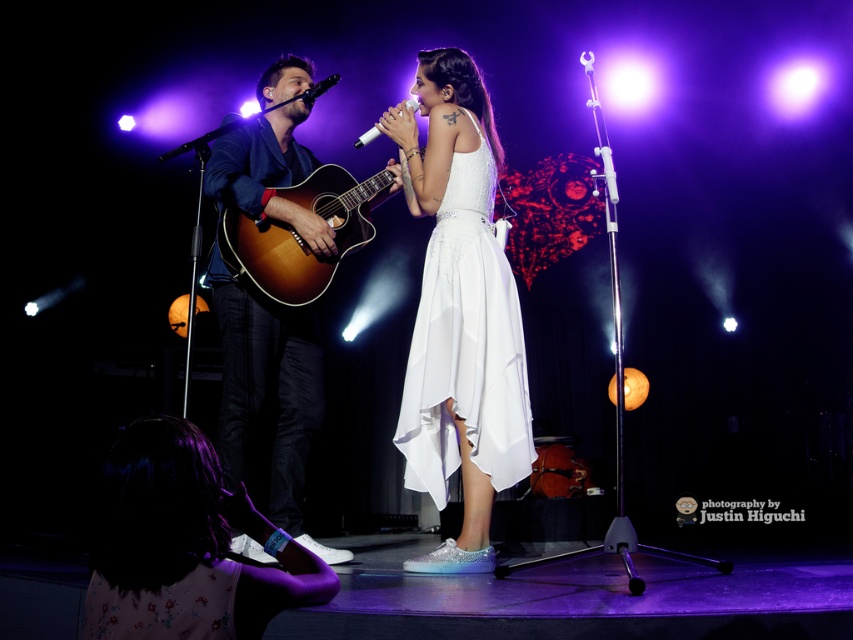
You are a stagehand preparing to adjust the lighting. You notice the white satin dress at center and the black matte microphone at upper center. Which object requires a wider spotlight to fully illuminate?

The white satin dress at center requires a wider spotlight because it is larger than the black matte microphone at upper center.

You are a stagehand who needs to ensure that the white satin dress at center and the black matte microphone at upper center do not block the main spotlight. Based on their sizes, which object might require adjustment to avoid blocking the light?

The white satin dress at center is wider than the black matte microphone at upper center, so it might require adjustment to avoid blocking the main spotlight.

You are a photographer capturing the live performance. You notice two points in the image at coordinates point (219, 557) and point (291, 84). Which point is nearer to the camera?

Point (219, 557) is closer to the camera than point (291, 84).